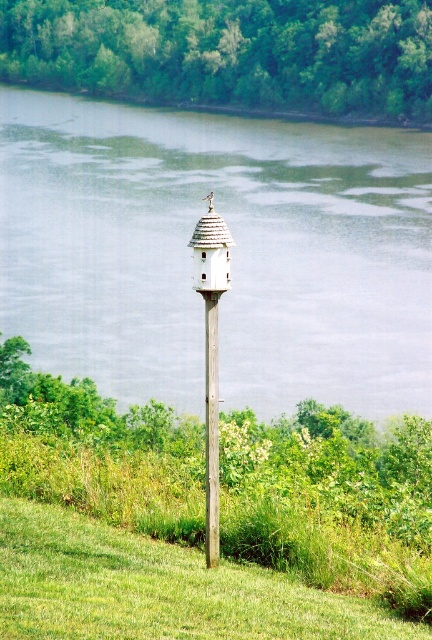
You are standing in the serene outdoor scene with the small white birdhouse on the wooden post. There is a point marked at coordinates (231, 253). What is located at that point?

The point at coordinates (231, 253) marks green water at center.

You are a small insect trying to move from the green grass at center to the white wood birdhouse at center. Which direction should you go to reach it?

The green grass at center is on the left side of the white wood birdhouse at center, so you should move to the right to reach it.

You are standing in the outdoor scene and want to place a small flag between the green water at center and the green grass at center. Which object should the flag be placed in front of to ensure it is closer to you?

The flag should be placed in front of the green grass at center because it is closer to you than the green water at center, which is further away.